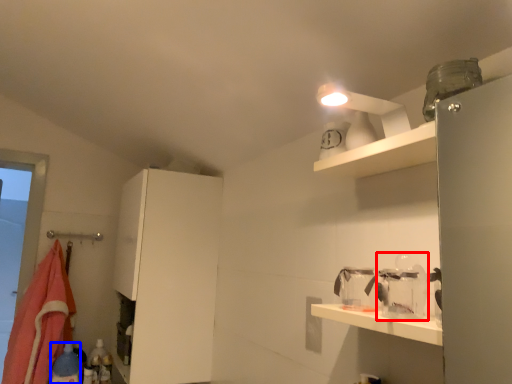
Question: Among these objects, which one is farthest to the camera, glass jar (highlighted by a red box) or bottle (highlighted by a blue box)?

Choices:
 (A) glass jar
 (B) bottle

Answer: (B)